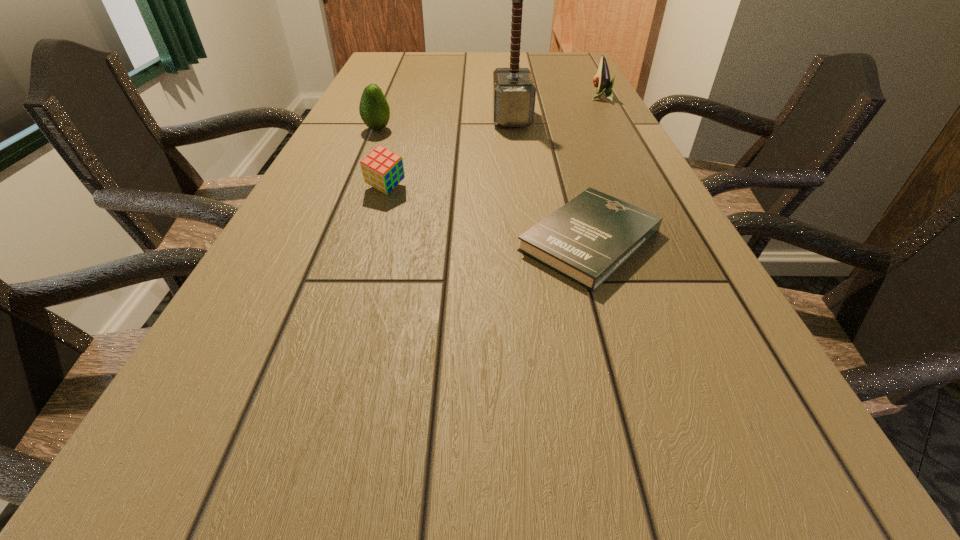
Locate an element on the screen. The height and width of the screenshot is (540, 960). blank space at the far left corner is located at coordinates (387, 70).

Locate an element on the screen. vacant space at the far right corner of the desktop is located at coordinates (550, 65).

Identify the location of free spot between the nearer avocado and the tallest object. The image size is (960, 540). (444, 124).

This screenshot has width=960, height=540. I want to click on free space between the nearer avocado and the tallest object, so click(444, 124).

Image resolution: width=960 pixels, height=540 pixels. I want to click on free spot between the left avocado and the hammer, so click(444, 124).

Locate an element on the screen. vacant point located between the nearer avocado and the tallest object is located at coordinates (444, 124).

At what (x,y) coordinates should I click in order to perform the action: click on unoccupied position between the second shortest object and the hammer. Please return your answer as a coordinate pair (x, y). Image resolution: width=960 pixels, height=540 pixels. Looking at the image, I should click on (449, 153).

Identify the location of free space between the cube and the shortest object. (488, 214).

This screenshot has width=960, height=540. In order to click on free space between the farther avocado and the shortest object in this screenshot , I will do `click(595, 169)`.

Locate which object is the fourth closest to the cube. Please provide its 2D coordinates. Your answer should be formatted as a tuple, i.e. [(x, y)], where the tuple contains the x and y coordinates of a point satisfying the conditions above.

[(602, 82)]